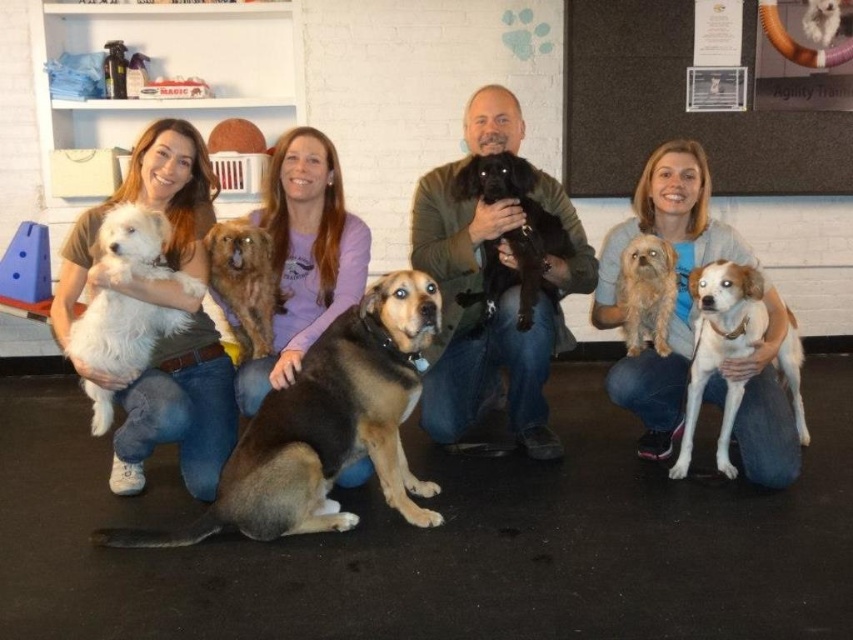
Question: Estimate the real-world distances between objects in this image. Which object is farther from the wooden corkboard at upper right?

Choices:
 (A) brown fur dog at center
 (B) white fur dog at left
 (C) soft fur dog at center

Answer: (B)

Question: From the image, what is the correct spatial relationship of brown fur dog at center in relation to green fuzzy sweater at center?

Choices:
 (A) left
 (B) right

Answer: (A)

Question: Does brown fur dog at center have a greater width compared to smooth purple shirt at center?

Choices:
 (A) no
 (B) yes

Answer: (B)

Question: Considering the relative positions of brown fur dog at center and shaggy brown dog at center in the image provided, where is brown fur dog at center located with respect to shaggy brown dog at center?

Choices:
 (A) left
 (B) right

Answer: (B)

Question: Which is farther from the white fur dog at left?

Choices:
 (A) soft fur dog at center
 (B) wooden corkboard at upper right

Answer: (B)

Question: Which object appears closest to the camera in this image?

Choices:
 (A) white fur dog at left
 (B) wooden corkboard at upper right

Answer: (A)